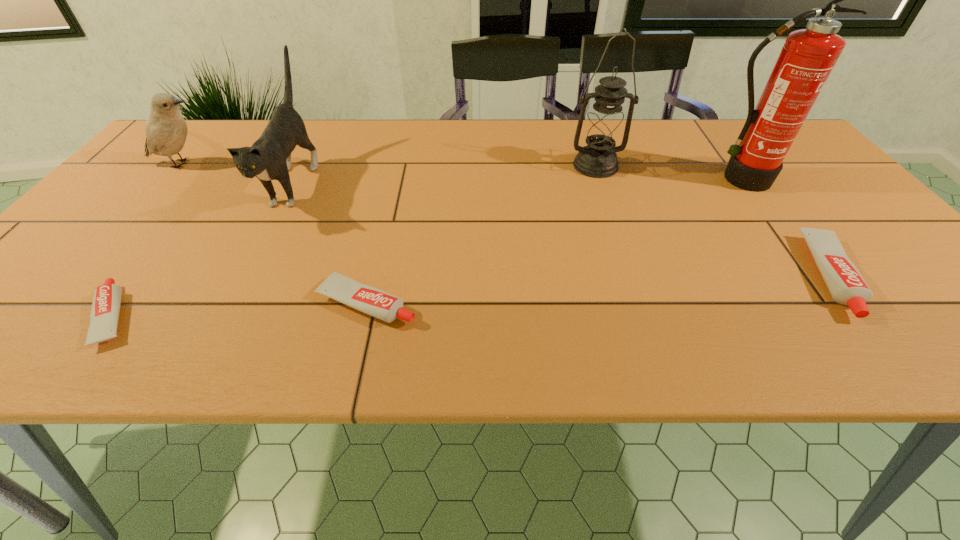
You are a GUI agent. You are given a task and a screenshot of the screen. Output one action in this format:
    pyautogui.click(x=<x>, y=<y>)
    Task: Click on the sixth shortest object
    Image resolution: width=960 pixels, height=540 pixels.
    Given the screenshot: What is the action you would take?
    pyautogui.click(x=603, y=128)

Identify the location of oil lamp. (603, 128).

You are a GUI agent. You are given a task and a screenshot of the screen. Output one action in this format:
    pyautogui.click(x=<x>, y=<y>)
    Task: Click on the vacant area located 0.380m on the right of the shortest object
    
    Given the screenshot: What is the action you would take?
    pyautogui.click(x=345, y=316)

This screenshot has width=960, height=540. In order to click on vacant area situated on the left of the second toothpaste from left to right in this screenshot , I will do `click(159, 302)`.

Locate an element on the screen. This screenshot has width=960, height=540. vacant point located on the left of the tallest toothpaste is located at coordinates (679, 276).

Find the location of `free location located 0.160m at the beak of the fourth tallest object`. free location located 0.160m at the beak of the fourth tallest object is located at coordinates (275, 164).

Locate an element on the screen. free location located on the front-facing side of the fire extinguisher is located at coordinates (786, 244).

Identify the location of blank area located 0.220m at the face of the third tallest object. The width and height of the screenshot is (960, 540). (231, 305).

Find the location of a particular element. The image size is (960, 540). free space located 0.400m on the right of the oil lamp is located at coordinates (772, 166).

Find the location of a particular element. The height and width of the screenshot is (540, 960). bird situated at the far edge is located at coordinates (166, 130).